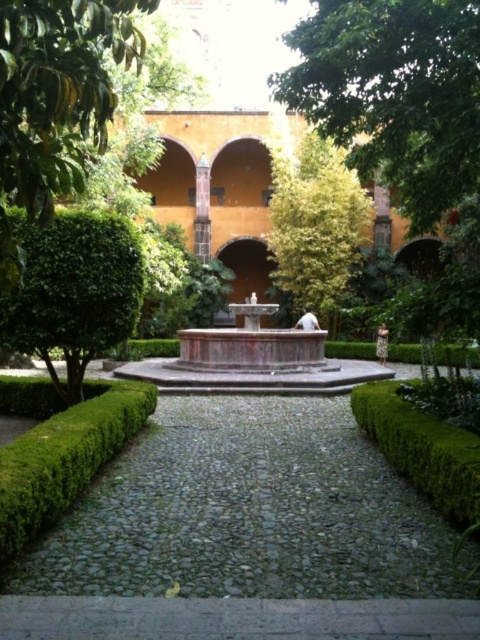
Question: Is gray cobblestone path at center wider than green leafy hedge at lower right?

Choices:
 (A) yes
 (B) no

Answer: (A)

Question: Which of these objects is positioned closest to the green leafy hedge at lower right?

Choices:
 (A) green leafy tree at upper center
 (B) green leafy bush at left

Answer: (B)

Question: Which of these objects is positioned farthest from the green leafy hedge at lower left?

Choices:
 (A) green leafy tree at upper center
 (B) green leafy tree at center
 (C) green leafy bush at left
 (D) green leafy hedge at lower right

Answer: (B)

Question: Where is green leafy tree at upper center located in relation to green leafy bush at left in the image?

Choices:
 (A) above
 (B) below

Answer: (A)

Question: Considering the relative positions of green leafy tree at upper center and green leafy tree at center in the image provided, where is green leafy tree at upper center located with respect to green leafy tree at center?

Choices:
 (A) below
 (B) above

Answer: (A)

Question: Which object is closer to the camera taking this photo?

Choices:
 (A) green leafy hedge at lower left
 (B) green leafy tree at center
 (C) marble fountain at center
 (D) green leafy tree at upper center

Answer: (A)